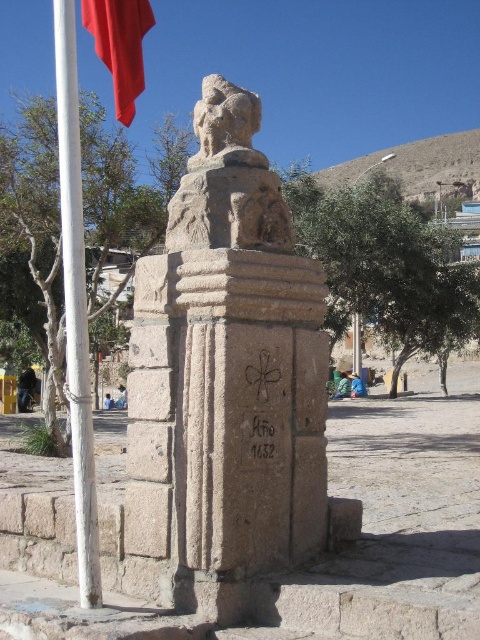
You are an archaeologist examining the monument. You need to determine which object is taller between the stone statue at center and the black stone writing at center. Which one is taller?

The stone statue at center is taller than the black stone writing at center according to the description.